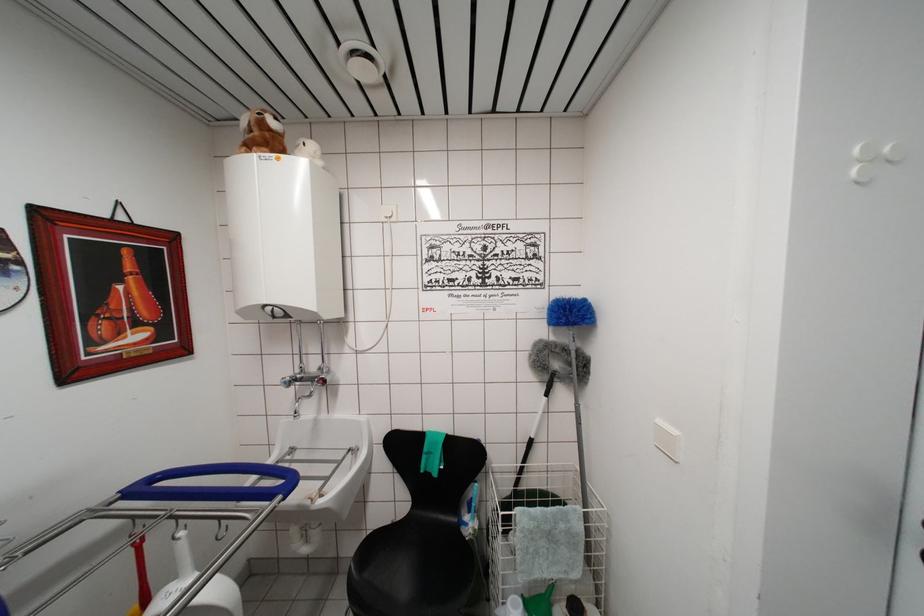
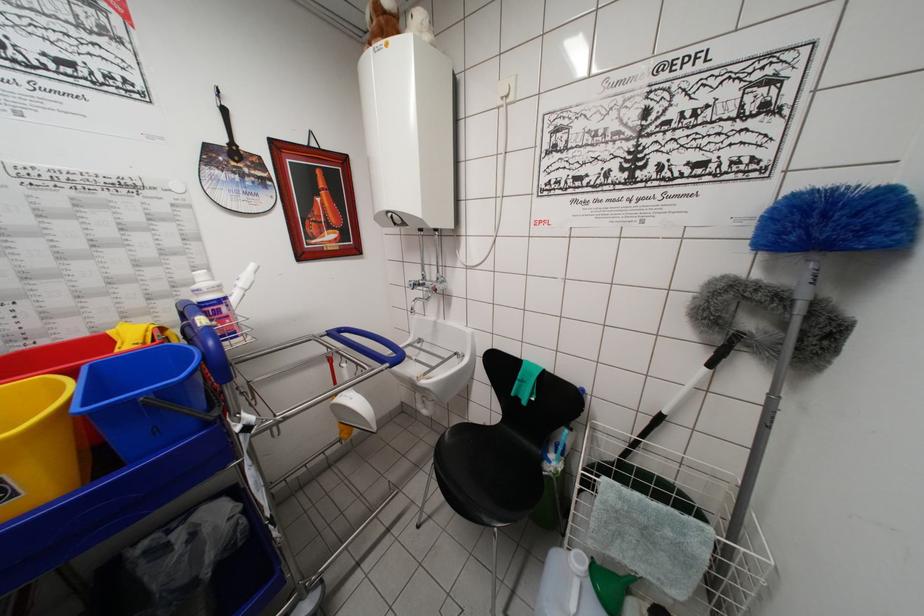
In the second image, find the point that corresponds to (301,387) in the first image.

(428, 294)